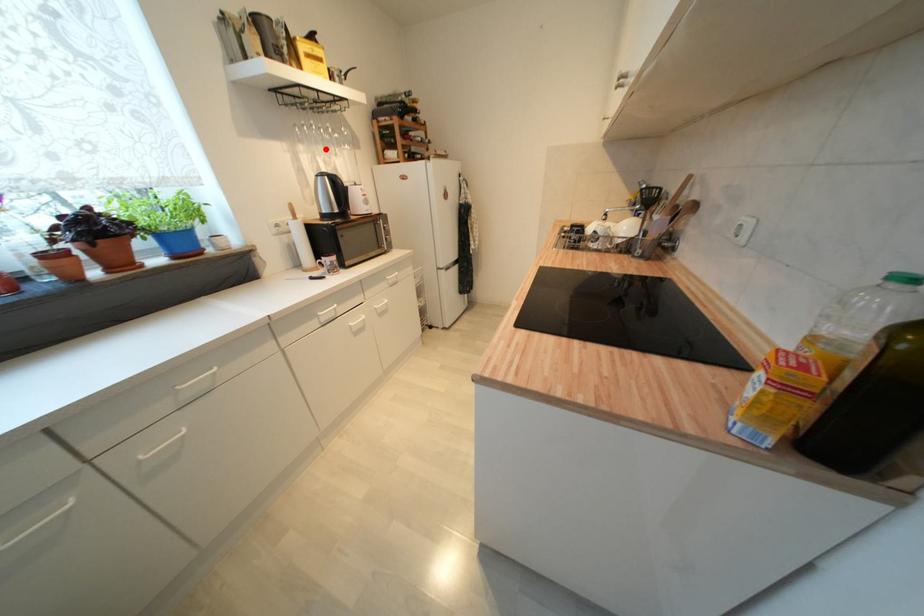
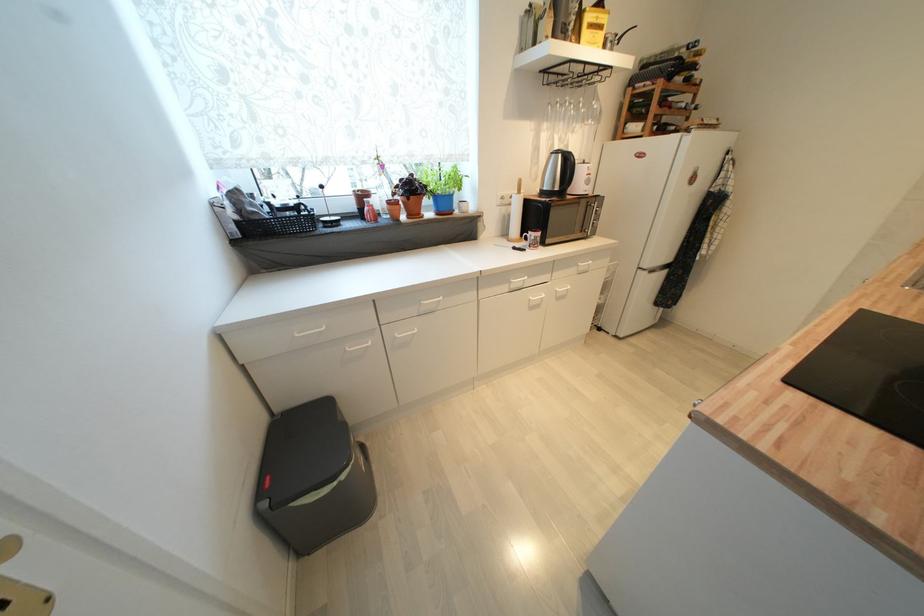
Find the pixel in the second image that matches the highlighted location in the first image.

(566, 127)